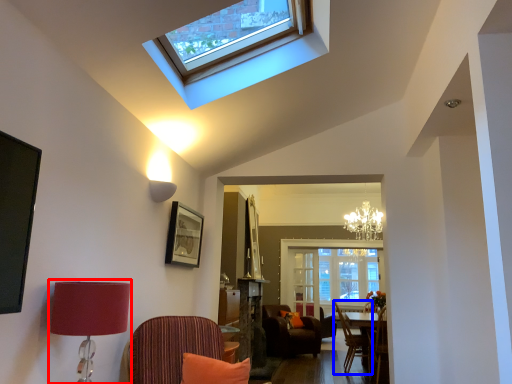
Question: Among these objects, which one is farthest to the camera, table lamp (highlighted by a red box) or chair (highlighted by a blue box)?

Choices:
 (A) table lamp
 (B) chair

Answer: (B)